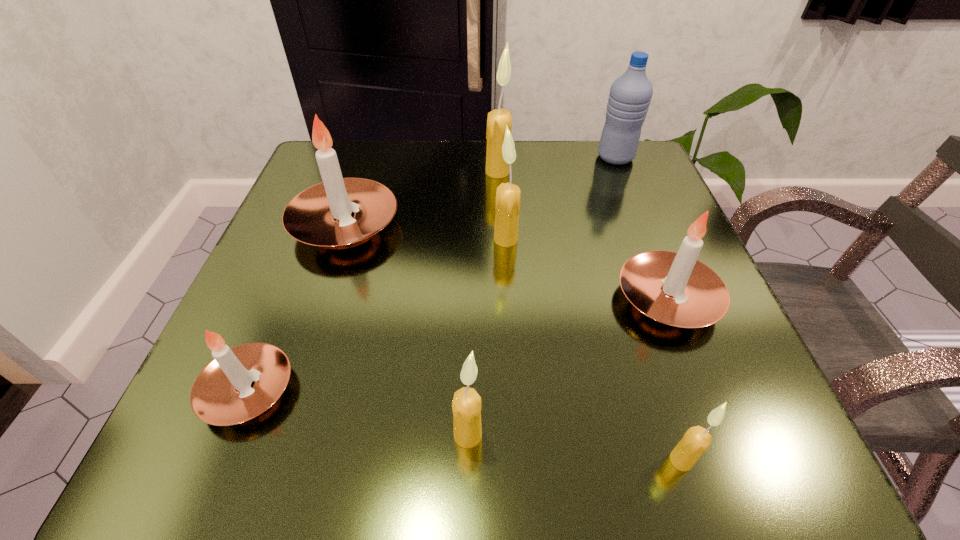
You are a GUI agent. You are given a task and a screenshot of the screen. Output one action in this format:
    pyautogui.click(x=<x>, y=<y>)
    Task: Click on the farthest cream candle
    
    Given the screenshot: What is the action you would take?
    pyautogui.click(x=496, y=167)

Image resolution: width=960 pixels, height=540 pixels. What are the coordinates of `the tallest object` in the screenshot? It's located at (496, 167).

This screenshot has height=540, width=960. Identify the location of blue water bottle. (x=630, y=95).

Where is `the farthest white candle`? the farthest white candle is located at coordinates (320, 215).

At what (x,y) coordinates should I click in order to perform the action: click on the second farthest cream candle. Please return your answer as a coordinate pair (x, y). This screenshot has width=960, height=540. Looking at the image, I should click on (507, 206).

This screenshot has height=540, width=960. I want to click on the fifth farthest object, so click(x=674, y=288).

At what (x,y) coordinates should I click in order to perform the action: click on the second smallest white candle. Please return your answer as a coordinate pair (x, y). Looking at the image, I should click on (674, 288).

Identify the location of the third farthest cream candle. (466, 406).

This screenshot has height=540, width=960. What are the coordinates of `the leftmost cream candle` in the screenshot? It's located at (466, 406).

Image resolution: width=960 pixels, height=540 pixels. I want to click on the smallest white candle, so click(x=240, y=383).